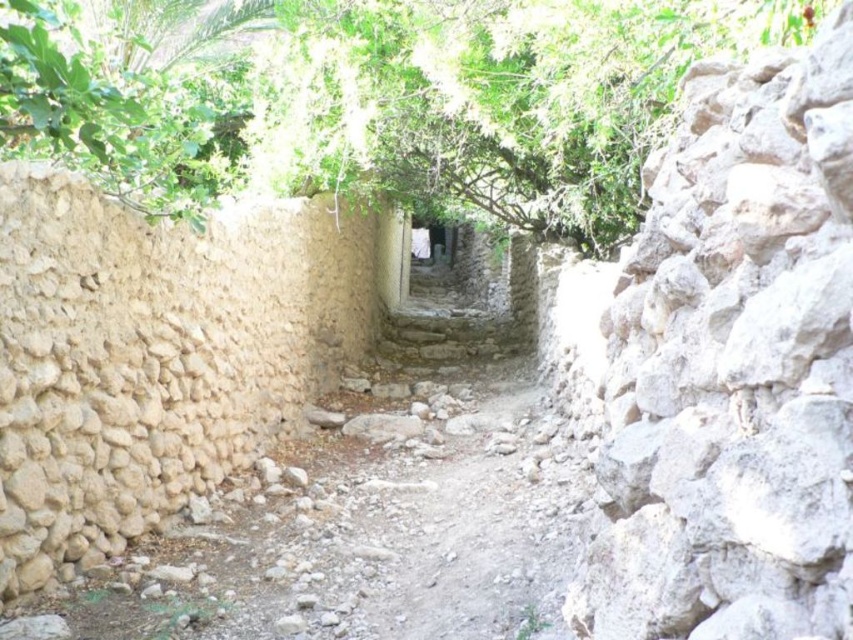
Which is behind, point (119, 35) or point (607, 451)?

The point (119, 35) is behind.

Looking at this image, is green leafy tree at upper center bigger than gray rough stone wall at right?

Correct, green leafy tree at upper center is larger in size than gray rough stone wall at right.

The image size is (853, 640). What are the coordinates of `green leafy tree at upper center` in the screenshot? It's located at (376, 99).